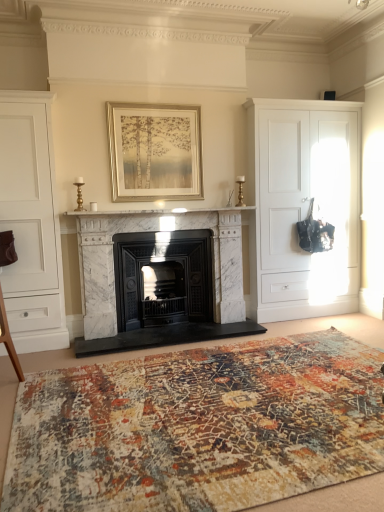
Question: Considering the positions of point (334, 144) and point (29, 250), is point (334, 144) closer or farther from the camera than point (29, 250)?

Choices:
 (A) closer
 (B) farther

Answer: (B)

Question: From a real-world perspective, is white matte cabinet at right, which is counted as the 2th cabinetry, starting from the front, positioned above or below white matte cabinet at left, arranged as the second cabinetry when viewed from the right?

Choices:
 (A) above
 (B) below

Answer: (A)

Question: Which is nearer to the white marble fireplace at center?

Choices:
 (A) gold metallic picture frame at upper center
 (B) black cast iron wood burning stove at center
 (C) white matte cabinet at right, which is counted as the 2th cabinetry, starting from the front
 (D) abstract patterned rug at center
 (E) white marble fireplace at center

Answer: (B)

Question: Estimate the real-world distances between objects in this image. Which object is farther from the white marble fireplace at center?

Choices:
 (A) abstract patterned rug at center
 (B) white matte cabinet at right, which is counted as the first cabinetry, starting from the back
 (C) gold metallic picture frame at upper center
 (D) white marble fireplace at center
 (E) white matte cabinet at left, the 2th cabinetry when ordered from back to front

Answer: (A)